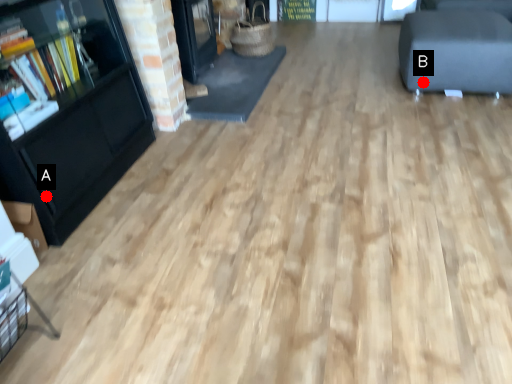
Question: Two points are circled on the image, labeled by A and B beside each circle. Which point is closer to the camera?

Choices:
 (A) A is closer
 (B) B is closer

Answer: (A)